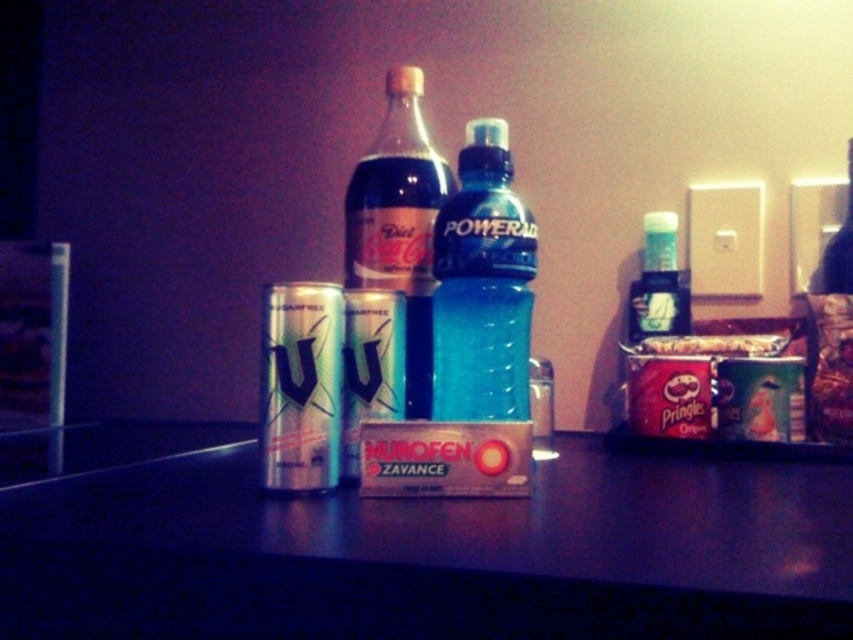
You are standing in a dimly lit room with a table in front of you. You see a diet coke glass bottle at center. Can you reach it without moving your body?

The diet coke glass bottle at center is 28.11 inches from viewer, so yes, you can reach it without moving your body as it is within arm reach.

You are organizing items on a table and see the metallic silver table at center and the blue translucent bottle at center. Which object is positioned to the left?

The metallic silver table at center is to the left of the blue translucent bottle at center.